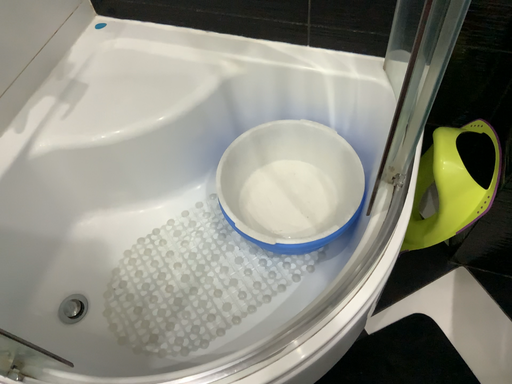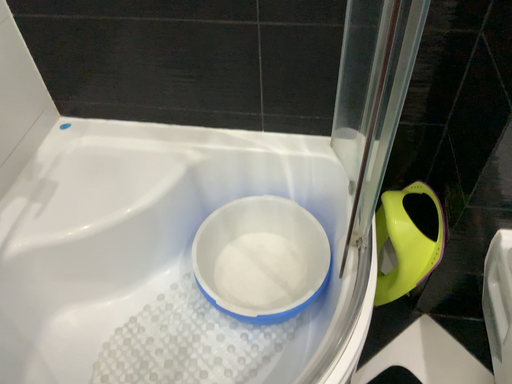
Question: Which way did the camera rotate in the video?

Choices:
 (A) rotated right
 (B) rotated left

Answer: (A)